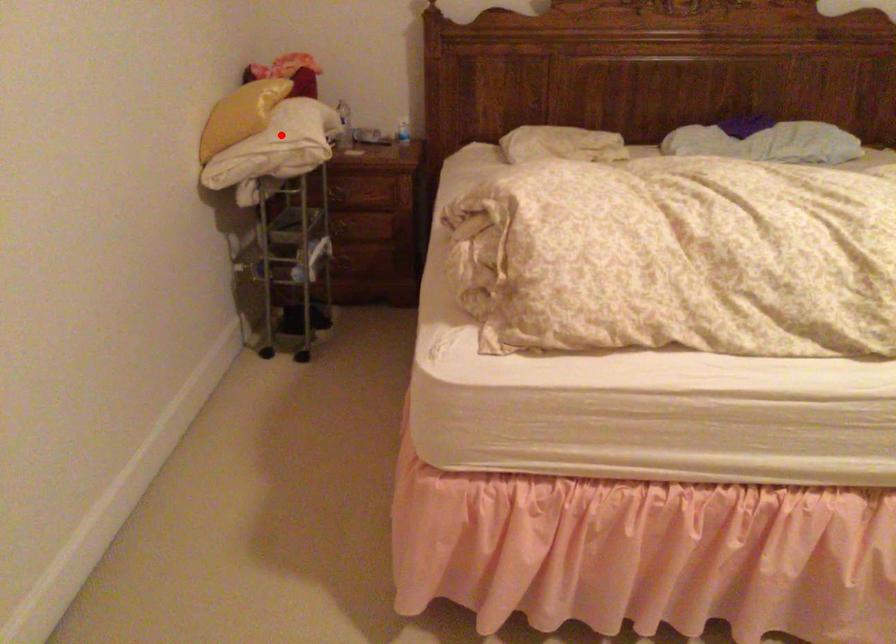
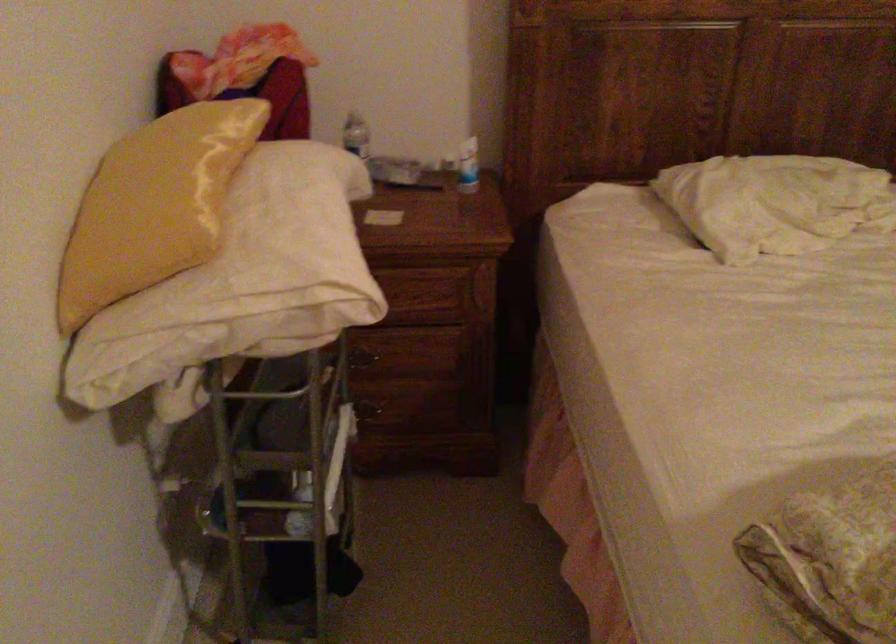
Question: I am providing you with two images of the same scene from different viewpoints. A red point is shown in image1. For the corresponding object point in image2, is it positioned nearer or farther from the camera?

Choices:
 (A) Nearer
 (B) Farther

Answer: (A)